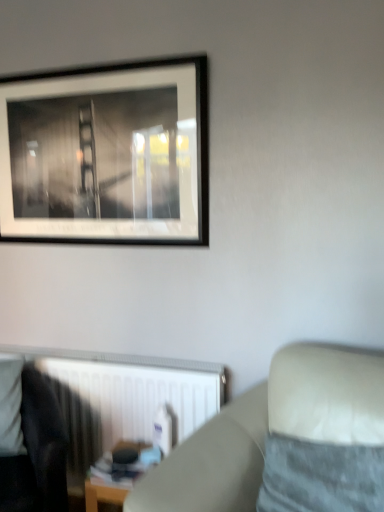
Identify the location of beige fabric couch at lower right. The image size is (384, 512). (270, 428).

This screenshot has width=384, height=512. What do you see at coordinates (30, 441) in the screenshot?
I see `dark fabric rocking chair at lower left` at bounding box center [30, 441].

The image size is (384, 512). What are the coordinates of `velvety gray pillow at lower right` in the screenshot? It's located at (320, 477).

You are a GUI agent. You are given a task and a screenshot of the screen. Output one action in this format:
    pyautogui.click(x=<x>, y=<y>)
    Task: Click on the wooden table at lower center
    
    Given the screenshot: What is the action you would take?
    pyautogui.click(x=103, y=493)

Identify the location of black matte picture frame at upper left. (106, 154).

This screenshot has width=384, height=512. Find the location of `beige fabric couch at lower right`. beige fabric couch at lower right is located at coordinates (270, 428).

Where is `table below the dark fabric rocking chair at lower left (from a real-world perspective)`? The height and width of the screenshot is (512, 384). table below the dark fabric rocking chair at lower left (from a real-world perspective) is located at coordinates (103, 493).

Does wooden table at lower center have a larger size compared to dark fabric rocking chair at lower left?

Actually, wooden table at lower center might be smaller than dark fabric rocking chair at lower left.

Considering the positions of points (88, 476) and (0, 365), is point (88, 476) farther from camera compared to point (0, 365)?

No, it is not.

From the image's perspective, is beige fabric couch at lower right over dark fabric rocking chair at lower left?

Indeed, from the image's perspective, beige fabric couch at lower right is shown above dark fabric rocking chair at lower left.

From a real-world perspective, which object rests below the other?

dark fabric rocking chair at lower left.

Considering the positions of objects beige fabric couch at lower right and dark fabric rocking chair at lower left in the image provided, who is in front, beige fabric couch at lower right or dark fabric rocking chair at lower left?

Positioned in front is beige fabric couch at lower right.

Considering the positions of objects beige fabric couch at lower right and dark fabric rocking chair at lower left in the image provided, who is more to the left, beige fabric couch at lower right or dark fabric rocking chair at lower left?

dark fabric rocking chair at lower left is more to the left.

Is white plastic radiator at lower left at the back of wooden table at lower center?

Yes, wooden table at lower center is facing away from white plastic radiator at lower left.

Choose the correct answer: Is wooden table at lower center inside white plastic radiator at lower left or outside it?

wooden table at lower center is outside white plastic radiator at lower left.

Is point (89, 485) positioned behind point (71, 378)?

That is False.

Looking at this image, between wooden table at lower center and white plastic radiator at lower left, which one appears on the right side from the viewer's perspective?

wooden table at lower center.

Is black matte picture frame at upper left positioned behind beige fabric couch at lower right?

Yes, the depth of black matte picture frame at upper left is greater than that of beige fabric couch at lower right.

How far apart are black matte picture frame at upper left and beige fabric couch at lower right?

black matte picture frame at upper left is 39.33 inches away from beige fabric couch at lower right.

Considering the sizes of objects black matte picture frame at upper left and beige fabric couch at lower right in the image provided, who is thinner, black matte picture frame at upper left or beige fabric couch at lower right?

black matte picture frame at upper left.

Is dark fabric rocking chair at lower left closer to the viewer compared to velvety gray pillow at lower right?

No, the depth of dark fabric rocking chair at lower left is greater than that of velvety gray pillow at lower right.

Is dark fabric rocking chair at lower left at the left side of velvety gray pillow at lower right?

Correct, you'll find dark fabric rocking chair at lower left to the left of velvety gray pillow at lower right.

Considering the relative sizes of dark fabric rocking chair at lower left and velvety gray pillow at lower right in the image provided, is dark fabric rocking chair at lower left bigger than velvety gray pillow at lower right?

Indeed, dark fabric rocking chair at lower left has a larger size compared to velvety gray pillow at lower right.

Which is behind, point (29, 440) or point (312, 490)?

The point (29, 440) is behind.

Measure the distance between white plastic radiator at lower left and dark fabric rocking chair at lower left.

25.25 centimeters.

Is white plastic radiator at lower left not near dark fabric rocking chair at lower left?

white plastic radiator at lower left is actually quite close to dark fabric rocking chair at lower left.

Can you tell me how much white plastic radiator at lower left and dark fabric rocking chair at lower left differ in facing direction?

42.5 degrees separate the facing orientations of white plastic radiator at lower left and dark fabric rocking chair at lower left.

Find the location of a particular element. Image resolution: width=384 pixels, height=512 pixels. radiator to the right of dark fabric rocking chair at lower left is located at coordinates (126, 403).

Is velvety gray pillow at lower right looking in the opposite direction of black matte picture frame at upper left?

velvety gray pillow at lower right does not have its back to black matte picture frame at upper left.

From the image's perspective, is velvety gray pillow at lower right under black matte picture frame at upper left?

Yes, from the image's perspective, velvety gray pillow at lower right is below black matte picture frame at upper left.

Is velvety gray pillow at lower right not near black matte picture frame at upper left?

velvety gray pillow at lower right is far away from black matte picture frame at upper left.

The width and height of the screenshot is (384, 512). Identify the location of rocking chair that appears on the left of wooden table at lower center. (30, 441).

The image size is (384, 512). Identify the location of studio couch in front of the dark fabric rocking chair at lower left. (270, 428).

Which object lies further to the anchor point black matte picture frame at upper left, wooden table at lower center or dark fabric rocking chair at lower left?

wooden table at lower center.

Looking at the image, which one is located closer to dark fabric rocking chair at lower left, velvety gray pillow at lower right or wooden table at lower center?

wooden table at lower center.

From the image, which object appears to be farther from black matte picture frame at upper left, white plastic radiator at lower left or wooden table at lower center?

The object further to black matte picture frame at upper left is wooden table at lower center.

Considering their positions, is wooden table at lower center positioned further to dark fabric rocking chair at lower left than velvety gray pillow at lower right?

velvety gray pillow at lower right is positioned further to the anchor dark fabric rocking chair at lower left.

Which object lies nearer to the anchor point black matte picture frame at upper left, beige fabric couch at lower right or white plastic radiator at lower left?

The object closer to black matte picture frame at upper left is white plastic radiator at lower left.

Which object lies further to the anchor point beige fabric couch at lower right, dark fabric rocking chair at lower left or white plastic radiator at lower left?

dark fabric rocking chair at lower left lies further to beige fabric couch at lower right than the other object.

Based on their spatial positions, is dark fabric rocking chair at lower left or black matte picture frame at upper left further from white plastic radiator at lower left?

black matte picture frame at upper left.

Which object lies nearer to the anchor point white plastic radiator at lower left, dark fabric rocking chair at lower left or wooden table at lower center?

Among the two, wooden table at lower center is located nearer to white plastic radiator at lower left.

The width and height of the screenshot is (384, 512). What are the coordinates of `rocking chair between beige fabric couch at lower right and white plastic radiator at lower left along the z-axis` in the screenshot? It's located at (30, 441).

Locate an element on the screen. This screenshot has width=384, height=512. rocking chair between black matte picture frame at upper left and wooden table at lower center vertically is located at coordinates (30, 441).

You are a GUI agent. You are given a task and a screenshot of the screen. Output one action in this format:
    pyautogui.click(x=<x>, y=<y>)
    Task: Click on the studio couch located between dark fabric rocking chair at lower left and velvety gray pillow at lower right in the left-right direction
    The width and height of the screenshot is (384, 512).
    Given the screenshot: What is the action you would take?
    pyautogui.click(x=270, y=428)

Locate an element on the screen. pillow between black matte picture frame at upper left and wooden table at lower center from top to bottom is located at coordinates point(320,477).